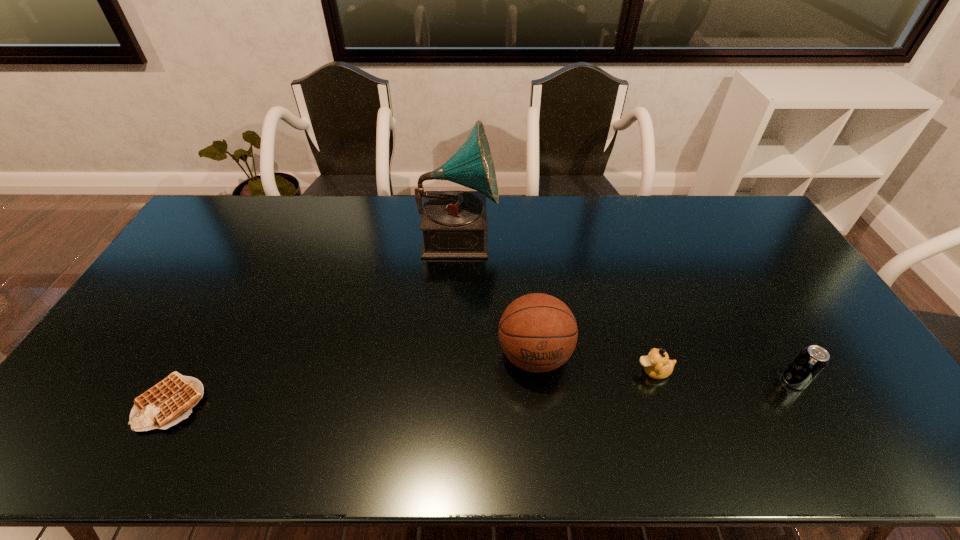
Locate an element on the screen. free space between the farthest object and the rightmost object is located at coordinates (626, 308).

The width and height of the screenshot is (960, 540). Find the location of `empty space between the second tallest object and the shortest object`. empty space between the second tallest object and the shortest object is located at coordinates (352, 379).

Identify which object is the fourth closest to the shortest object. Please provide its 2D coordinates. Your answer should be formatted as a tuple, i.e. [(x, y)], where the tuple contains the x and y coordinates of a point satisfying the conditions above.

[(811, 361)]

Locate an element on the screen. object that is the closest to the third shortest object is located at coordinates (657, 365).

Locate an element on the screen. This screenshot has width=960, height=540. free region that satisfies the following two spatial constraints: 1. on the back side of the rightmost object; 2. on the horn of the farthest object is located at coordinates (709, 234).

Where is `free space that satisfies the following two spatial constraints: 1. on the horn of the third tallest object; 2. on the left side of the record player`? This screenshot has height=540, width=960. free space that satisfies the following two spatial constraints: 1. on the horn of the third tallest object; 2. on the left side of the record player is located at coordinates (450, 381).

Locate an element on the screen. vacant position in the image that satisfies the following two spatial constraints: 1. on the face of the fourth object from left to right; 2. on the left side of the rightmost object is located at coordinates (657, 381).

Where is `vacant space that satisfies the following two spatial constraints: 1. on the back side of the soda can; 2. on the horn of the tallest object`? This screenshot has width=960, height=540. vacant space that satisfies the following two spatial constraints: 1. on the back side of the soda can; 2. on the horn of the tallest object is located at coordinates (709, 234).